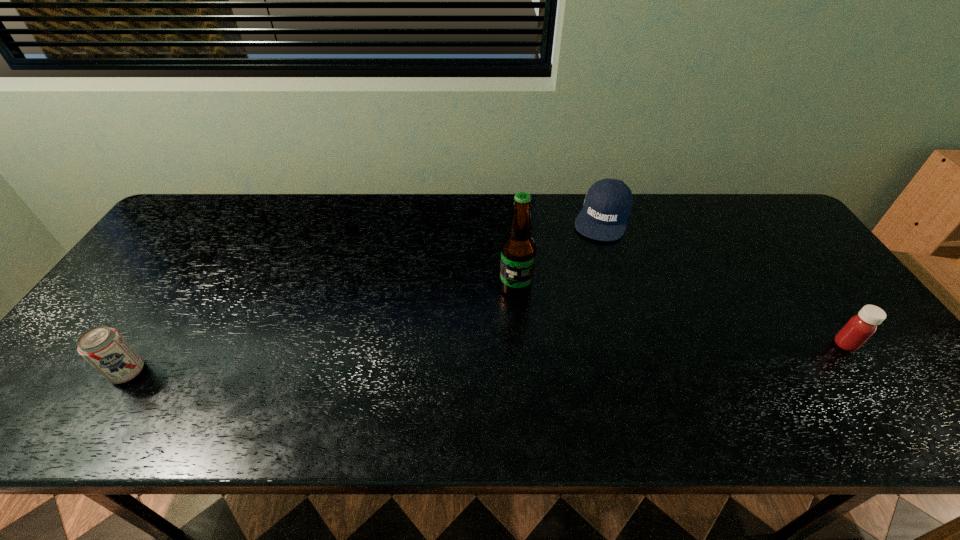
Where is `free point between the shortest object and the third object from right to left`? This screenshot has width=960, height=540. free point between the shortest object and the third object from right to left is located at coordinates (559, 253).

The width and height of the screenshot is (960, 540). Find the location of `empty space between the leftmost object and the farthest object`. empty space between the leftmost object and the farthest object is located at coordinates (366, 295).

Locate an element on the screen. The height and width of the screenshot is (540, 960). vacant area that lies between the second object from left to right and the second nearest object is located at coordinates (681, 316).

This screenshot has height=540, width=960. Find the location of `vacant space that's between the rightmost object and the beer bottle`. vacant space that's between the rightmost object and the beer bottle is located at coordinates tap(681, 316).

The width and height of the screenshot is (960, 540). I want to click on vacant space in between the beer bottle and the nearest object, so point(322,330).

Where is `vacant area that lies between the medicine and the leftmost object`? vacant area that lies between the medicine and the leftmost object is located at coordinates (487, 358).

The height and width of the screenshot is (540, 960). Find the location of `empty space that is in between the rightmost object and the third nearest object`. empty space that is in between the rightmost object and the third nearest object is located at coordinates (681, 316).

Locate an element on the screen. The image size is (960, 540). object that can be found as the closest to the baseball cap is located at coordinates (518, 250).

You are a GUI agent. You are given a task and a screenshot of the screen. Output one action in this format:
    pyautogui.click(x=<x>, y=<y>)
    Task: Click on the object that stands as the third closest to the shortest object
    Image resolution: width=960 pixels, height=540 pixels.
    Given the screenshot: What is the action you would take?
    pyautogui.click(x=105, y=349)